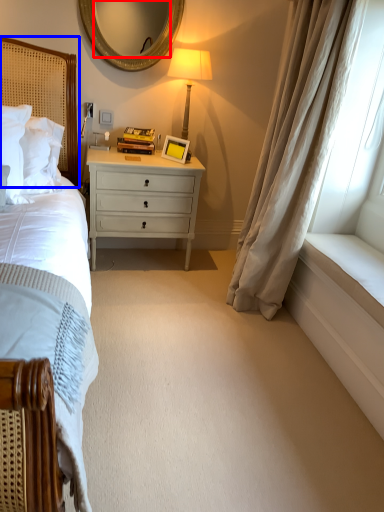
Question: Which object is closer to the camera taking this photo, mirror (highlighted by a red box) or headboard (highlighted by a blue box)?

Choices:
 (A) mirror
 (B) headboard

Answer: (B)